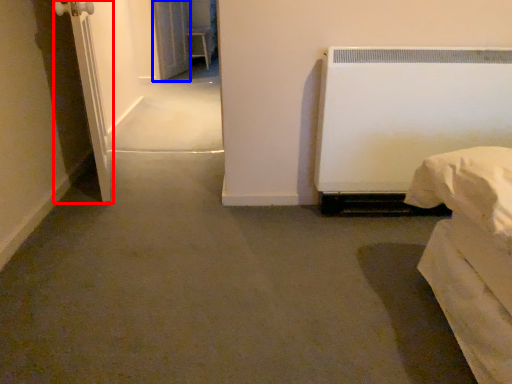
Question: Which point is closer to the camera, screen door (highlighted by a red box) or screen door (highlighted by a blue box)?

Choices:
 (A) screen door
 (B) screen door

Answer: (A)